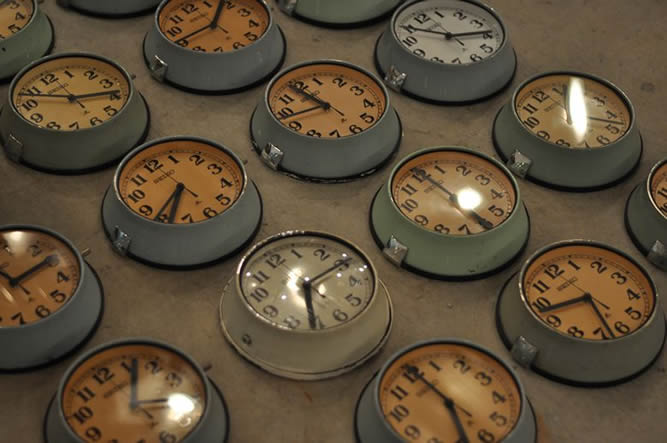
You are a GUI agent. You are given a task and a screenshot of the screen. Output one action in this format:
    pyautogui.click(x=<x>, y=<y>)
    Task: Click on the clock 6
    This screenshot has width=667, height=443.
    Given the screenshot: What is the action you would take?
    pyautogui.click(x=657, y=204)